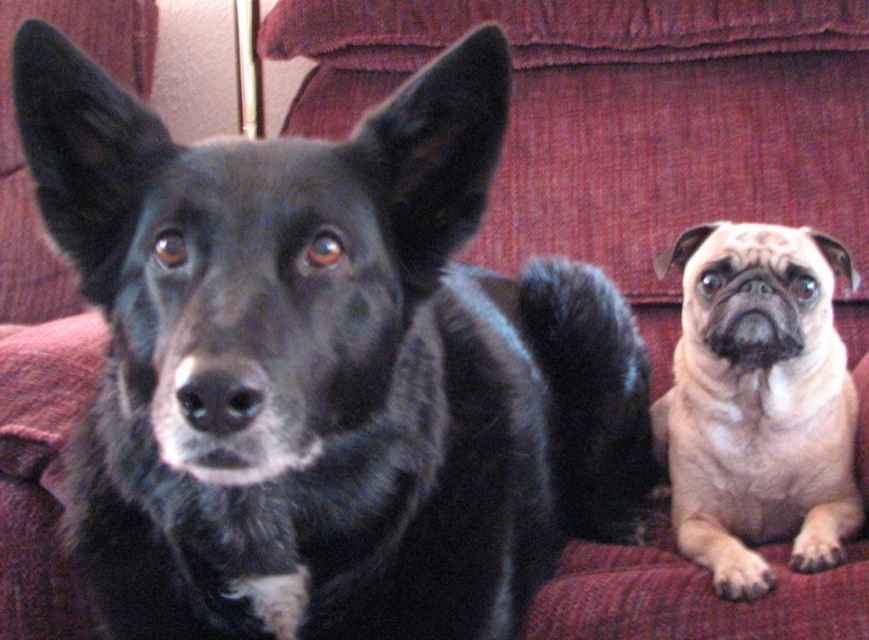
Question: Among these objects, which one is farthest from the camera?

Choices:
 (A) beige fur pug at right
 (B) black fur dog at center

Answer: (A)

Question: Does black fur dog at center appear on the left side of beige fur pug at right?

Choices:
 (A) yes
 (B) no

Answer: (A)

Question: Can you confirm if black fur dog at center is wider than beige fur pug at right?

Choices:
 (A) no
 (B) yes

Answer: (B)

Question: Which point is closer to the camera?

Choices:
 (A) black fur dog at center
 (B) beige fur pug at right

Answer: (A)

Question: Does black fur dog at center lie behind beige fur pug at right?

Choices:
 (A) no
 (B) yes

Answer: (A)

Question: Among these objects, which one is farthest from the camera?

Choices:
 (A) black fur dog at center
 (B) beige fur pug at right

Answer: (B)